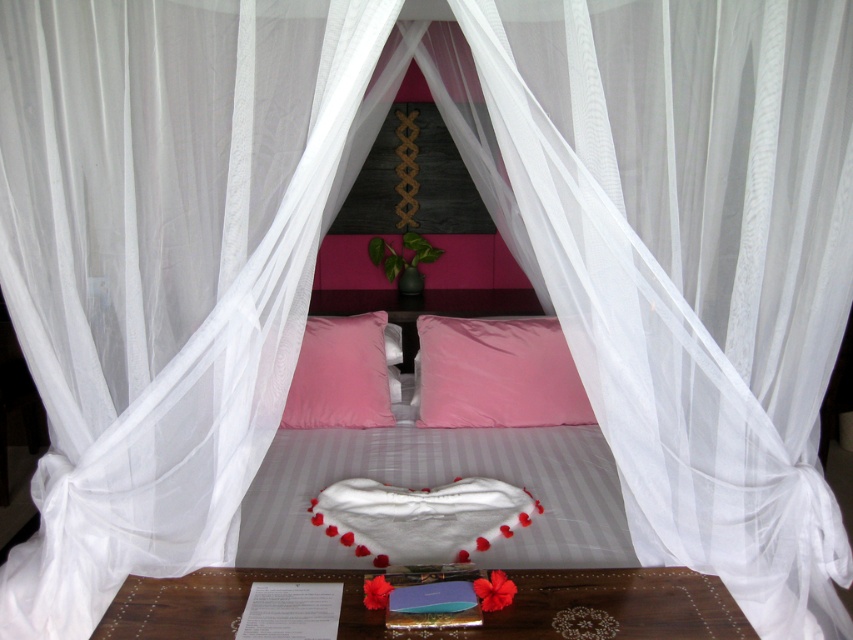
Which is below, wooden tray at lower center or pink matte pillow at center?

wooden tray at lower center is below.

Can you confirm if wooden tray at lower center is shorter than pink matte pillow at center?

Yes, wooden tray at lower center is shorter than pink matte pillow at center.

Is point (480, 628) in front of point (511, 410)?

That is True.

Where is `wooden tray at lower center`? wooden tray at lower center is located at coordinates (453, 628).

Is pink velvet pillows at center to the right of white fluffy heart at center from the viewer's perspective?

Yes, pink velvet pillows at center is to the right of white fluffy heart at center.

Can you confirm if pink velvet pillows at center is taller than white fluffy heart at center?

Yes.

Image resolution: width=853 pixels, height=640 pixels. What do you see at coordinates (440, 483) in the screenshot?
I see `pink velvet pillows at center` at bounding box center [440, 483].

Identify the location of pink velvet pillows at center. Image resolution: width=853 pixels, height=640 pixels. (440, 483).

Between pink velvet pillows at center and wooden tray at lower center, which one is positioned higher?

pink velvet pillows at center

Is pink velvet pillows at center taller than wooden tray at lower center?

Yes, pink velvet pillows at center is taller than wooden tray at lower center.

Between point (279, 502) and point (215, 616), which one is positioned behind?

The point (279, 502) is more distant.

Where is `pink velvet pillows at center`? The height and width of the screenshot is (640, 853). pink velvet pillows at center is located at coordinates (440, 483).